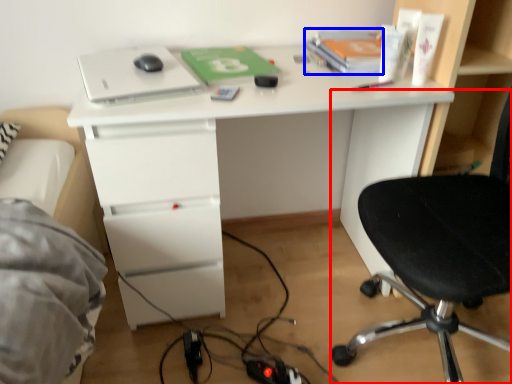
Question: Which point is further to the camera, chair (highlighted by a red box) or book (highlighted by a blue box)?

Choices:
 (A) chair
 (B) book

Answer: (B)